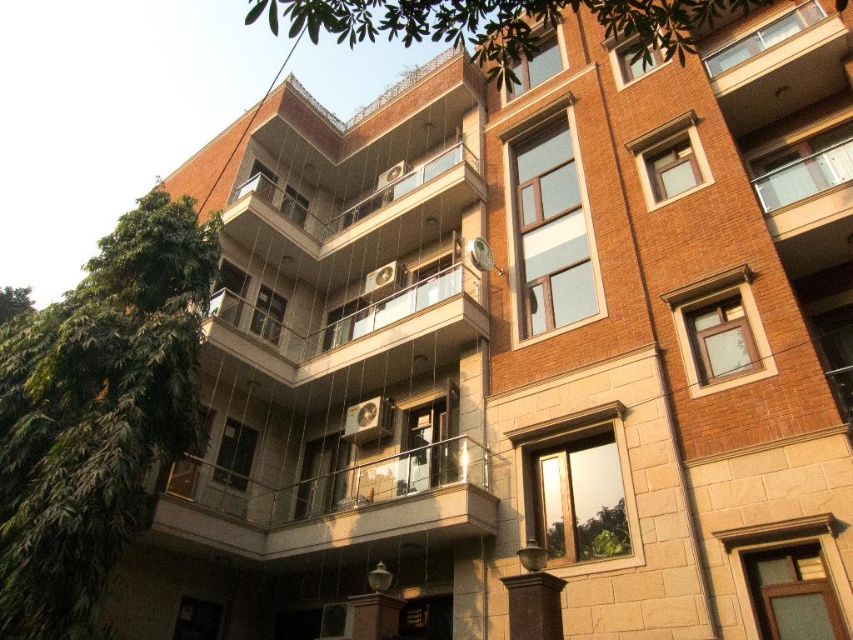
Looking at this image, is glassy white balcony at center further to camera compared to green leafy tree at upper left?

Yes, glassy white balcony at center is further from the viewer.

Find the location of a particular element. The width and height of the screenshot is (853, 640). glassy white balcony at center is located at coordinates (351, 328).

Who is shorter, clear glass balcony at center or green leafy tree at upper left?

clear glass balcony at center

Is clear glass balcony at center wider than green leafy tree at upper left?

No.

This screenshot has width=853, height=640. Find the location of `clear glass balcony at center`. clear glass balcony at center is located at coordinates (334, 502).

You are a GUI agent. You are given a task and a screenshot of the screen. Output one action in this format:
    pyautogui.click(x=<x>, y=<y>)
    Task: Click on the clear glass balcony at center
    This screenshot has width=853, height=640.
    Given the screenshot: What is the action you would take?
    pyautogui.click(x=334, y=502)

Is green leafy tree at upper center below glassy white balcony at center?

No.

Identify the location of green leafy tree at upper center. (500, 24).

This screenshot has height=640, width=853. Identify the location of green leafy tree at upper center. (500, 24).